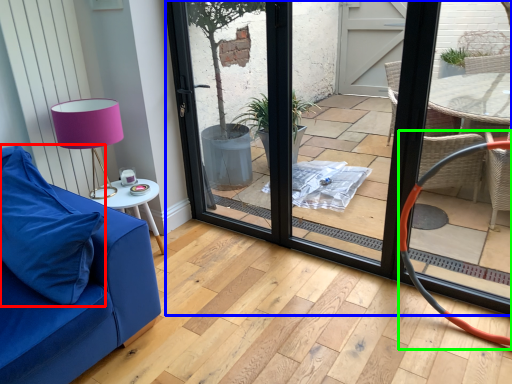
Question: Considering the real-world distances, which object is closest to pillow (highlighted by a red box)? door (highlighted by a blue box) or armchair (highlighted by a green box).

Choices:
 (A) door
 (B) armchair

Answer: (A)